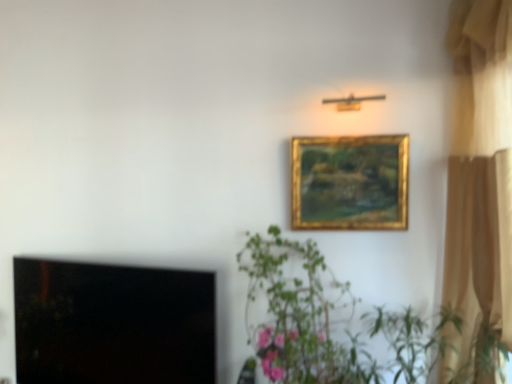
Consider the image. What is the approximate height of beige fabric curtain at right?

beige fabric curtain at right is 6.41 feet tall.

The width and height of the screenshot is (512, 384). Describe the element at coordinates (350, 182) in the screenshot. I see `gold/gilded picture frame at upper center` at that location.

Locate an element on the screen. green leafy plant at center is located at coordinates (295, 316).

From the image's perspective, who appears lower, black glass window screen at lower left or green leafy plant at center?

black glass window screen at lower left.

From a real-world perspective, between black glass window screen at lower left and green leafy plant at center, who is vertically lower?

black glass window screen at lower left, from a real-world perspective.

Is point (55, 337) closer or farther from the camera than point (358, 359)?

Point (55, 337) is farther from the camera than point (358, 359).

Is black glass window screen at lower left thinner than green leafy plant at center?

Yes.

Could you tell me if green leafy plant at center is facing green leafy plant at center?

→ No.

Is green leafy plant at center far from green leafy plant at center?

No, green leafy plant at center is not far from green leafy plant at center.

How different are the orientations of green leafy plant at center and green leafy plant at center in degrees?

There is a 7.01e-05-degree angle between the facing directions of green leafy plant at center and green leafy plant at center.

Is green leafy plant at center to the right of green leafy plant at center from the viewer's perspective?

Correct, you'll find green leafy plant at center to the right of green leafy plant at center.

Considering the relative positions of green leafy plant at center and gold/gilded picture frame at upper center in the image provided, is green leafy plant at center to the left of gold/gilded picture frame at upper center from the viewer's perspective?

Yes.

The height and width of the screenshot is (384, 512). I want to click on houseplant in front of the gold/gilded picture frame at upper center, so click(x=328, y=322).

Can you confirm if green leafy plant at center is thinner than gold/gilded picture frame at upper center?

No.

From the image's perspective, between green leafy plant at center and gold/gilded picture frame at upper center, who is located below?

green leafy plant at center appears lower in the image.

From the image's perspective, is beige fabric curtain at right positioned above or below gold/gilded picture frame at upper center?

Clearly, from the image's perspective, beige fabric curtain at right is below gold/gilded picture frame at upper center.

Consider the image. Does beige fabric curtain at right appear on the right side of gold/gilded picture frame at upper center?

Yes, beige fabric curtain at right is to the right of gold/gilded picture frame at upper center.

Can you confirm if beige fabric curtain at right is thinner than gold/gilded picture frame at upper center?

No.

Is beige fabric curtain at right far away from gold/gilded picture frame at upper center?

No, beige fabric curtain at right is not far from gold/gilded picture frame at upper center.

Could you tell me if black glass window screen at lower left is turned towards beige fabric curtain at right?

No, black glass window screen at lower left does not turn towards beige fabric curtain at right.

Is black glass window screen at lower left in front of beige fabric curtain at right?

No.

From the image's perspective, is black glass window screen at lower left above or below beige fabric curtain at right?

Based on their image positions, black glass window screen at lower left is located beneath beige fabric curtain at right.

Considering the relative sizes of green leafy plant at center and beige fabric curtain at right in the image provided, is green leafy plant at center wider than beige fabric curtain at right?

Yes.

Is beige fabric curtain at right inside green leafy plant at center?

No, beige fabric curtain at right is not inside green leafy plant at center.

Considering the sizes of objects green leafy plant at center and beige fabric curtain at right in the image provided, who is taller, green leafy plant at center or beige fabric curtain at right?

With more height is beige fabric curtain at right.

Between gold/gilded picture frame at upper center and black glass window screen at lower left, which one has more height?

black glass window screen at lower left is taller.

In the image, is gold/gilded picture frame at upper center on the left side or the right side of black glass window screen at lower left?

Clearly, gold/gilded picture frame at upper center is on the right of black glass window screen at lower left in the image.

Is gold/gilded picture frame at upper center positioned beyond the bounds of black glass window screen at lower left?

Yes, gold/gilded picture frame at upper center is outside of black glass window screen at lower left.

Does gold/gilded picture frame at upper center have a larger size compared to black glass window screen at lower left?

Incorrect, gold/gilded picture frame at upper center is not larger than black glass window screen at lower left.

At what (x,y) coordinates should I click in order to perform the action: click on houseplant located in front of the black glass window screen at lower left. Please return your answer as a coordinate pair (x, y). This screenshot has height=384, width=512. Looking at the image, I should click on (328, 322).

Find the location of `plant that is on the left side of green leafy plant at center`. plant that is on the left side of green leafy plant at center is located at coordinates (295, 316).

Based on their spatial positions, is black glass window screen at lower left or gold/gilded picture frame at upper center closer to beige fabric curtain at right?

The object closer to beige fabric curtain at right is gold/gilded picture frame at upper center.

From the image, which object appears to be farther from green leafy plant at center, black glass window screen at lower left or green leafy plant at center?

Based on the image, black glass window screen at lower left appears to be further to green leafy plant at center.

From the image, which object appears to be nearer to gold/gilded picture frame at upper center, black glass window screen at lower left or beige fabric curtain at right?

The object closer to gold/gilded picture frame at upper center is beige fabric curtain at right.

Considering their positions, is gold/gilded picture frame at upper center positioned closer to black glass window screen at lower left than green leafy plant at center?

green leafy plant at center.

Estimate the real-world distances between objects in this image. Which object is further from beige fabric curtain at right, black glass window screen at lower left or green leafy plant at center?

Based on the image, black glass window screen at lower left appears to be further to beige fabric curtain at right.

From the image, which object appears to be nearer to green leafy plant at center, beige fabric curtain at right or gold/gilded picture frame at upper center?

Among the two, gold/gilded picture frame at upper center is located nearer to green leafy plant at center.

Which object lies nearer to the anchor point green leafy plant at center, beige fabric curtain at right or black glass window screen at lower left?

beige fabric curtain at right.

Which object lies nearer to the anchor point beige fabric curtain at right, green leafy plant at center or black glass window screen at lower left?

green leafy plant at center is closer to beige fabric curtain at right.

Image resolution: width=512 pixels, height=384 pixels. Find the location of `houseplant between black glass window screen at lower left and gold/gilded picture frame at upper center from left to right`. houseplant between black glass window screen at lower left and gold/gilded picture frame at upper center from left to right is located at coordinates (328, 322).

Find the location of `plant between black glass window screen at lower left and green leafy plant at center in the horizontal direction`. plant between black glass window screen at lower left and green leafy plant at center in the horizontal direction is located at coordinates (295, 316).

Where is `plant situated between black glass window screen at lower left and beige fabric curtain at right from left to right`? The height and width of the screenshot is (384, 512). plant situated between black glass window screen at lower left and beige fabric curtain at right from left to right is located at coordinates (295, 316).

I want to click on houseplant situated between green leafy plant at center and beige fabric curtain at right from left to right, so click(x=328, y=322).